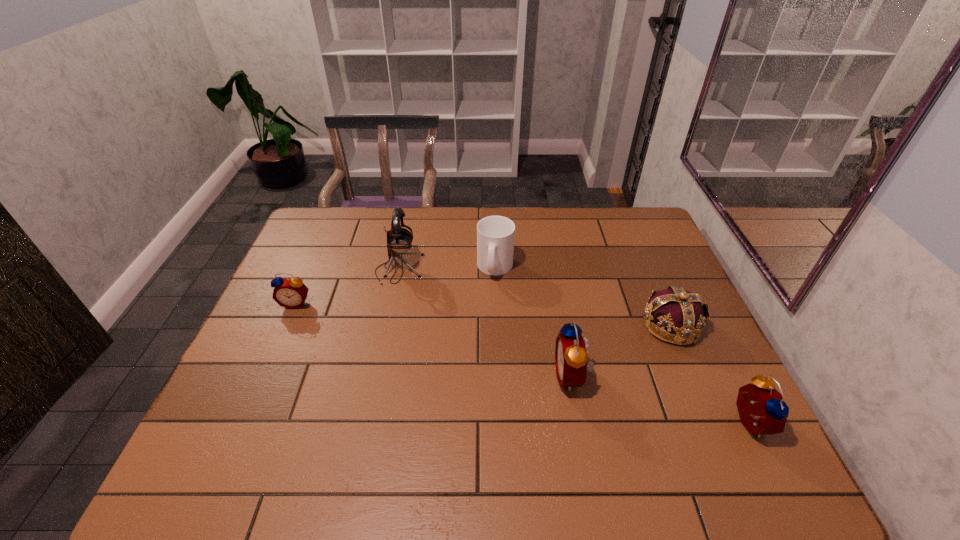
Locate an element on the screen. the leftmost alarm clock is located at coordinates (291, 293).

Find the location of `the leftmost object`. the leftmost object is located at coordinates (291, 293).

You are a GUI agent. You are given a task and a screenshot of the screen. Output one action in this format:
    pyautogui.click(x=<x>, y=<y>)
    Task: Click on the fifth farthest object
    The width and height of the screenshot is (960, 540).
    Given the screenshot: What is the action you would take?
    pyautogui.click(x=571, y=356)

Locate an element on the screen. Image resolution: width=960 pixels, height=540 pixels. the second farthest alarm clock is located at coordinates (571, 356).

The image size is (960, 540). I want to click on the rightmost alarm clock, so click(x=762, y=411).

Where is `the nearest object`? The width and height of the screenshot is (960, 540). the nearest object is located at coordinates (762, 411).

Locate an element on the screen. The width and height of the screenshot is (960, 540). the fourth object from right to left is located at coordinates (495, 234).

Identify the location of the tallest object. pyautogui.click(x=399, y=240).

Identify the location of earphone. [x=399, y=240].

Where is `crown`? This screenshot has height=540, width=960. crown is located at coordinates (680, 312).